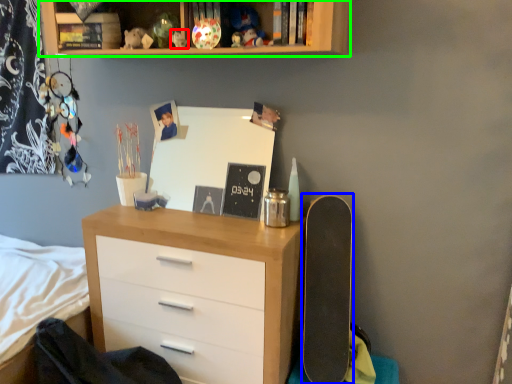
Question: Which object is positioned closest to toy (highlighted by a red box)? Select from skateboard (highlighted by a blue box) and shelf (highlighted by a green box).

Choices:
 (A) skateboard
 (B) shelf

Answer: (B)